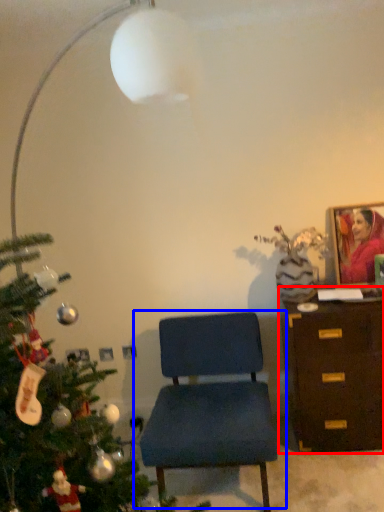
Question: Which point is closer to the camera, chest of drawers (highlighted by a red box) or chair (highlighted by a blue box)?

Choices:
 (A) chest of drawers
 (B) chair

Answer: (B)